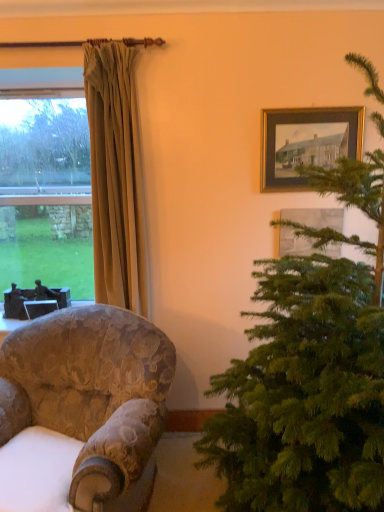
Question: Does metallic silver picture frame at upper left, the 3th picture frame in the front-to-back sequence, have a lesser width compared to wooden framed picture at upper right, which is the third picture frame in left-to-right order?

Choices:
 (A) yes
 (B) no

Answer: (B)

Question: Can we say metallic silver picture frame at upper left, the third picture frame in the top-to-bottom sequence, lies outside wooden framed picture at upper right, acting as the 2th picture frame starting from the bottom?

Choices:
 (A) no
 (B) yes

Answer: (B)

Question: From the image's perspective, is metallic silver picture frame at upper left, the third picture frame in the top-to-bottom sequence, above wooden framed picture at upper right, the 1th picture frame from the right?

Choices:
 (A) no
 (B) yes

Answer: (A)

Question: Considering the relative sizes of metallic silver picture frame at upper left, marked as the 1th picture frame in a left-to-right arrangement, and wooden framed picture at upper right, positioned as the second picture frame in front-to-back order, in the image provided, is metallic silver picture frame at upper left, marked as the 1th picture frame in a left-to-right arrangement, taller than wooden framed picture at upper right, positioned as the second picture frame in front-to-back order,?

Choices:
 (A) yes
 (B) no

Answer: (B)

Question: From a real-world perspective, is metallic silver picture frame at upper left, the third picture frame viewed from the right, located beneath wooden framed picture at upper right, positioned as the second picture frame in front-to-back order?

Choices:
 (A) yes
 (B) no

Answer: (A)

Question: Is the position of metallic silver picture frame at upper left, the third picture frame in the top-to-bottom sequence, more distant than that of wooden framed picture at upper right, acting as the 2th picture frame starting from the bottom?

Choices:
 (A) yes
 (B) no

Answer: (A)

Question: From a real-world perspective, is beige fabric curtain at left over gold-framed picture at upper right, positioned as the first picture frame in top-to-bottom order?

Choices:
 (A) no
 (B) yes

Answer: (A)

Question: Considering the relative positions of beige fabric curtain at left and gold-framed picture at upper right, positioned as the 2th picture frame in right-to-left order, in the image provided, is beige fabric curtain at left to the left of gold-framed picture at upper right, positioned as the 2th picture frame in right-to-left order, from the viewer's perspective?

Choices:
 (A) yes
 (B) no

Answer: (A)

Question: Is beige fabric curtain at left oriented away from gold-framed picture at upper right, the third picture frame from the bottom?

Choices:
 (A) no
 (B) yes

Answer: (A)

Question: Can gold-framed picture at upper right, the third picture frame from the bottom, be found inside beige fabric curtain at left?

Choices:
 (A) no
 (B) yes

Answer: (A)

Question: From a real-world perspective, does beige fabric curtain at left sit lower than gold-framed picture at upper right, positioned as the first picture frame in top-to-bottom order?

Choices:
 (A) no
 (B) yes

Answer: (B)

Question: Can you confirm if beige fabric curtain at left is thinner than gold-framed picture at upper right, positioned as the first picture frame in top-to-bottom order?

Choices:
 (A) yes
 (B) no

Answer: (B)

Question: Can you confirm if green needle-like at right is taller than metallic silver picture frame at upper left, the 3th picture frame in the front-to-back sequence?

Choices:
 (A) no
 (B) yes

Answer: (B)